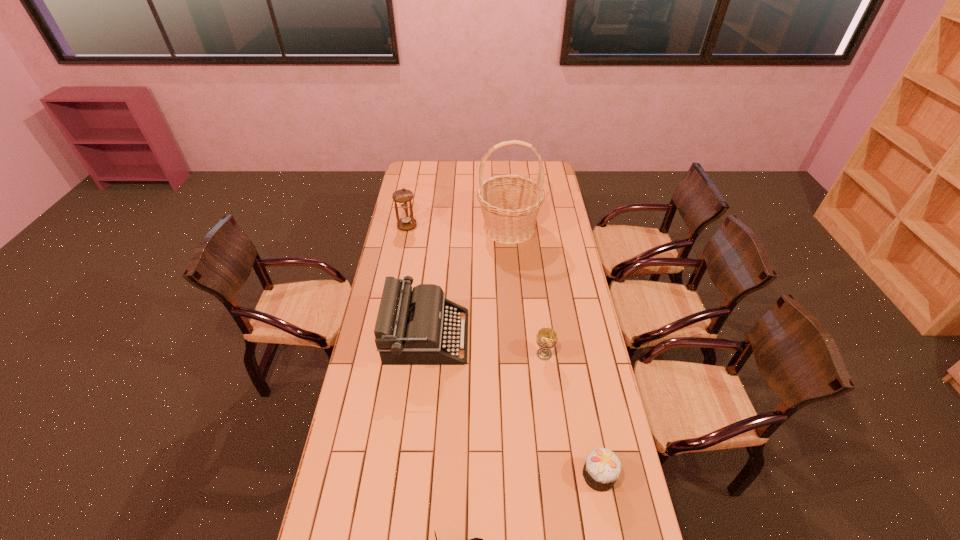
You are a GUI agent. You are given a task and a screenshot of the screen. Output one action in this format:
    pyautogui.click(x=<x>, y=<y>)
    Task: Click on the free spot that satisfies the following two spatial constraints: 1. on the typing side of the rightmost object; 2. on the right side of the typewriter
    This screenshot has height=540, width=960.
    Given the screenshot: What is the action you would take?
    pyautogui.click(x=412, y=475)

This screenshot has height=540, width=960. Identify the location of free spot that satisfies the following two spatial constraints: 1. on the front side of the chalice; 2. on the left side of the hourglass. (382, 354).